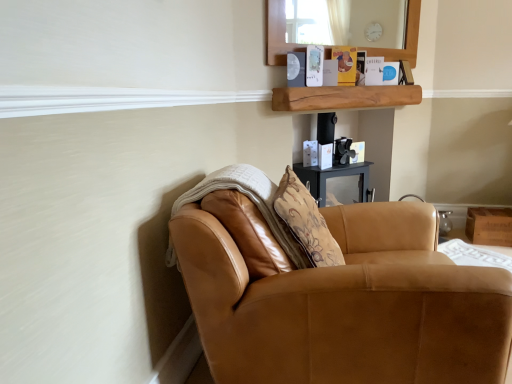
Question: From the image's perspective, is wooden box at lower right positioned above or below saddle brown leather chair at lower right?

Choices:
 (A) above
 (B) below

Answer: (A)

Question: In terms of size, does wooden box at lower right appear bigger or smaller than saddle brown leather chair at lower right?

Choices:
 (A) small
 (B) big

Answer: (A)

Question: Considering the real-world distances, which object is farthest from the wooden box at lower right?

Choices:
 (A) saddle brown leather chair at lower right
 (B) natural wood shelf at upper center

Answer: (A)

Question: Considering the real-world distances, which object is closest to the natural wood shelf at upper center?

Choices:
 (A) wooden box at lower right
 (B) saddle brown leather chair at lower right

Answer: (A)